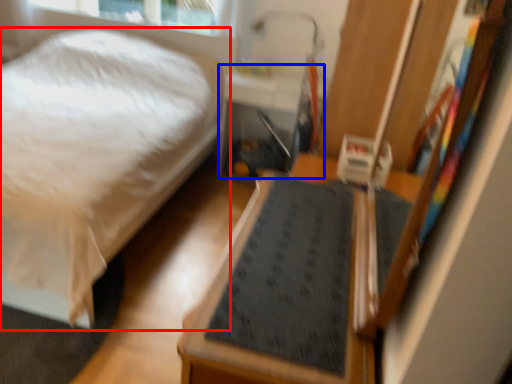
Question: Among these objects, which one is nearest to the camera, bed (highlighted by a red box) or table (highlighted by a blue box)?

Choices:
 (A) bed
 (B) table

Answer: (A)